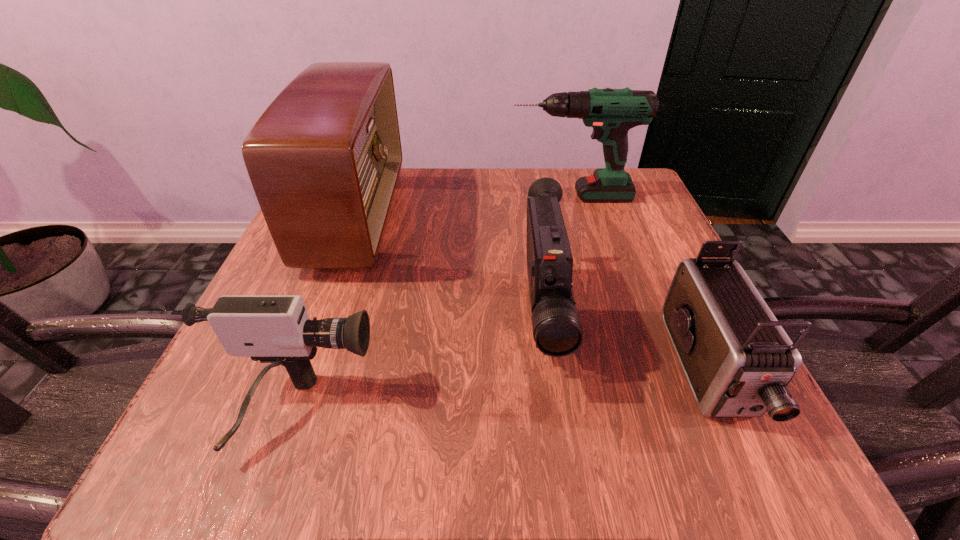
The width and height of the screenshot is (960, 540). I want to click on object present at the near right corner, so pyautogui.click(x=738, y=360).

At what (x,y) coordinates should I click in order to perform the action: click on vacant space at the far edge of the desktop. Please return your answer as a coordinate pair (x, y). This screenshot has width=960, height=540. Looking at the image, I should click on (398, 219).

Find the location of `vacant area at the near edge`. vacant area at the near edge is located at coordinates (464, 442).

This screenshot has width=960, height=540. Identify the location of vacant space at the left edge of the desktop. 326,307.

Locate an element on the screen. Image resolution: width=960 pixels, height=540 pixels. free space at the right edge of the desktop is located at coordinates (633, 253).

Identify the location of vacant space at the far right corner of the desktop. (636, 187).

Identify the location of vacant area at the near right corner. The width and height of the screenshot is (960, 540). (719, 461).

The height and width of the screenshot is (540, 960). Find the location of `free point between the second camcorder from left to right and the leftmost camcorder`. free point between the second camcorder from left to right and the leftmost camcorder is located at coordinates (420, 366).

Locate an element on the screen. The height and width of the screenshot is (540, 960). vacant area that lies between the drill and the leftmost camcorder is located at coordinates (434, 305).

Identify the location of vacant area between the drill and the radio receiver. (464, 207).